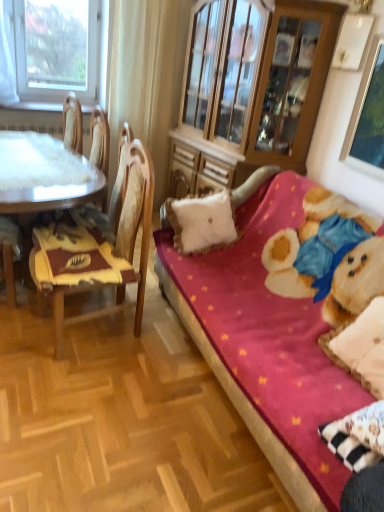
Question: Is velvet pink couch at right outside wooden cabinet at center?

Choices:
 (A) no
 (B) yes

Answer: (B)

Question: Are velvet pink couch at right and wooden cabinet at center making contact?

Choices:
 (A) yes
 (B) no

Answer: (B)

Question: Can you confirm if velvet pink couch at right is bigger than wooden cabinet at center?

Choices:
 (A) no
 (B) yes

Answer: (B)

Question: Is velvet pink couch at right not near wooden cabinet at center?

Choices:
 (A) no
 (B) yes

Answer: (B)

Question: From the image's perspective, is velvet pink couch at right located above wooden cabinet at center?

Choices:
 (A) no
 (B) yes

Answer: (A)

Question: From a real-world perspective, does velvet pink couch at right sit lower than wooden cabinet at center?

Choices:
 (A) yes
 (B) no

Answer: (A)

Question: Is transparent glass window at upper left closer to the viewer compared to wooden cabinet at center?

Choices:
 (A) yes
 (B) no

Answer: (B)

Question: Could you tell me if transparent glass window at upper left is facing wooden cabinet at center?

Choices:
 (A) yes
 (B) no

Answer: (B)

Question: Does transparent glass window at upper left have a greater width compared to wooden cabinet at center?

Choices:
 (A) no
 (B) yes

Answer: (A)

Question: Does transparent glass window at upper left have a greater height compared to wooden cabinet at center?

Choices:
 (A) no
 (B) yes

Answer: (A)

Question: From the image's perspective, is transparent glass window at upper left on wooden cabinet at center?

Choices:
 (A) no
 (B) yes

Answer: (B)

Question: Considering the relative sizes of transparent glass window at upper left and wooden cabinet at center in the image provided, is transparent glass window at upper left shorter than wooden cabinet at center?

Choices:
 (A) no
 (B) yes

Answer: (B)

Question: From the image's perspective, is white fabric curtain at upper left located beneath white glossy table at left?

Choices:
 (A) yes
 (B) no

Answer: (B)